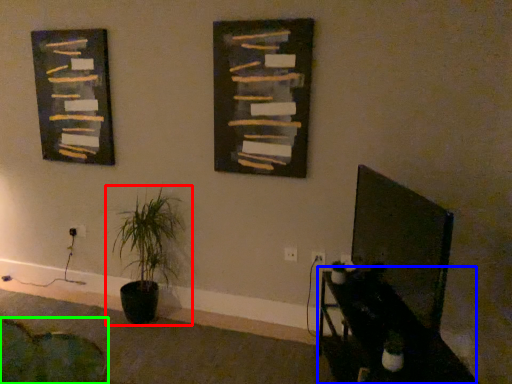
Question: Which object is the farthest from houseplant (highlighted by a red box)? Choose among these: table (highlighted by a blue box) or swivel chair (highlighted by a green box).

Choices:
 (A) table
 (B) swivel chair

Answer: (A)